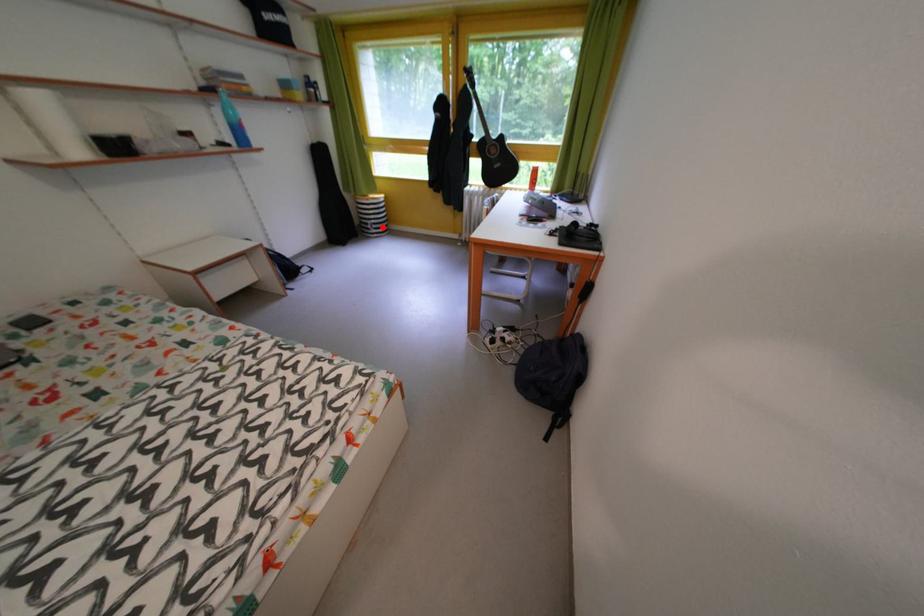
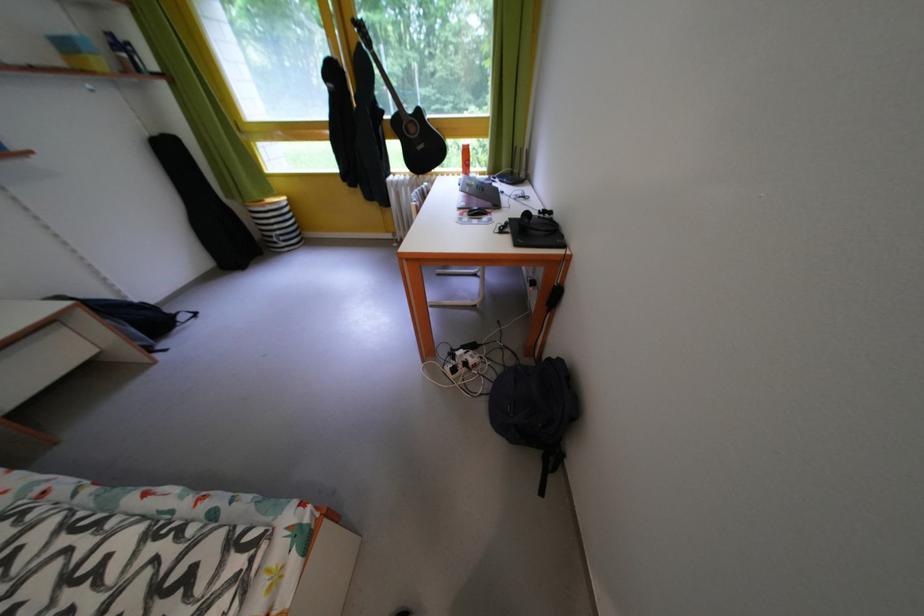
The point at the highlighted location is marked in the first image. Where is the corresponding point in the second image?

(287, 238)